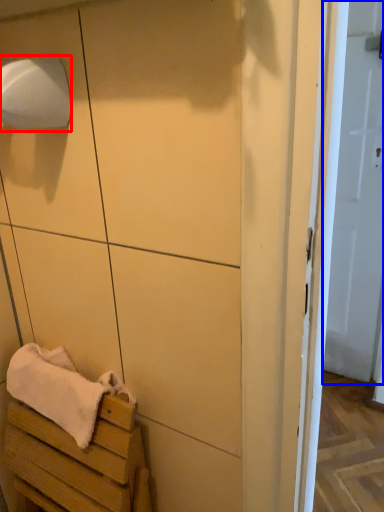
Question: Among these objects, which one is farthest to the camera, toilet paper (highlighted by a red box) or door (highlighted by a blue box)?

Choices:
 (A) toilet paper
 (B) door

Answer: (B)